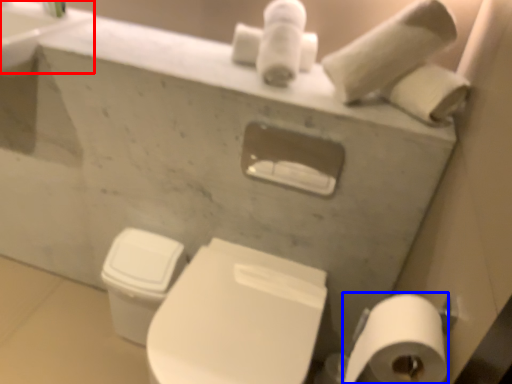
Question: Which object appears closest to the camera in this image, sink (highlighted by a red box) or toilet paper (highlighted by a blue box)?

Choices:
 (A) sink
 (B) toilet paper

Answer: (B)